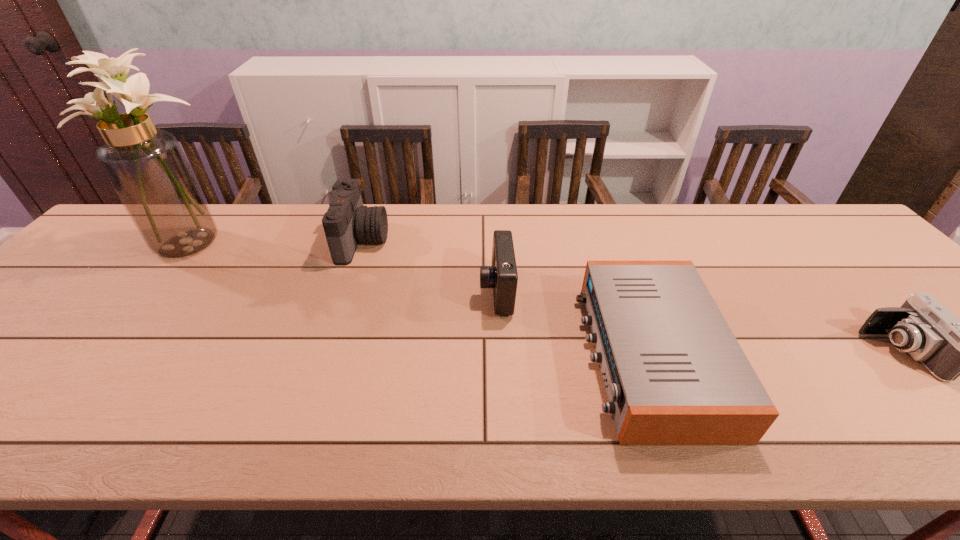
You are a GUI agent. You are given a task and a screenshot of the screen. Output one action in this format:
    pyautogui.click(x=<x>, y=<y>)
    Task: Click on the flower arrangement positioned at the far edge
    This screenshot has width=960, height=540.
    Given the screenshot: What is the action you would take?
    pyautogui.click(x=146, y=166)

Where is `camera located at the far edge`? The height and width of the screenshot is (540, 960). camera located at the far edge is located at coordinates (347, 221).

Where is `object that is at the near edge`? The width and height of the screenshot is (960, 540). object that is at the near edge is located at coordinates coord(675,374).

Where is `object that is positioned at the left edge`? Image resolution: width=960 pixels, height=540 pixels. object that is positioned at the left edge is located at coordinates (146, 166).

I want to click on object that is at the right edge, so click(x=948, y=347).

Image resolution: width=960 pixels, height=540 pixels. Find the location of `object at the far left corner`. object at the far left corner is located at coordinates (146, 166).

At what (x,y) coordinates should I click in order to perform the action: click on free space at the far edge. Please return your answer as a coordinate pair (x, y). This screenshot has width=960, height=540. Looking at the image, I should click on (429, 210).

In the image, there is a desktop. What are the coordinates of `vacant space at the near edge` in the screenshot? It's located at (329, 446).

You are a GUI agent. You are given a task and a screenshot of the screen. Output one action in this format:
    pyautogui.click(x=<x>, y=<y>)
    Task: Click on the free spot at the left edge of the desktop
    The width and height of the screenshot is (960, 540).
    Given the screenshot: What is the action you would take?
    pyautogui.click(x=86, y=317)

Where is `vacant area that lies between the second camera from left to right and the tallest object`? Image resolution: width=960 pixels, height=540 pixels. vacant area that lies between the second camera from left to right and the tallest object is located at coordinates (347, 266).